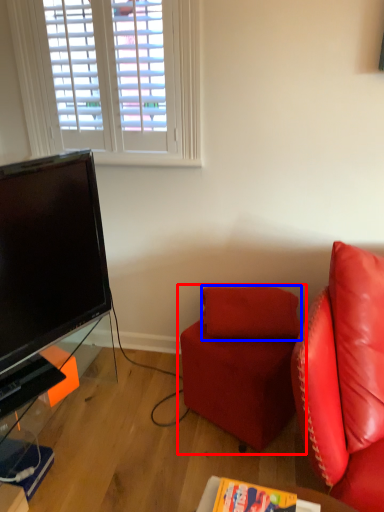
Question: Among these objects, which one is nearest to the camera, studio couch (highlighted by a red box) or pillow (highlighted by a blue box)?

Choices:
 (A) studio couch
 (B) pillow

Answer: (A)